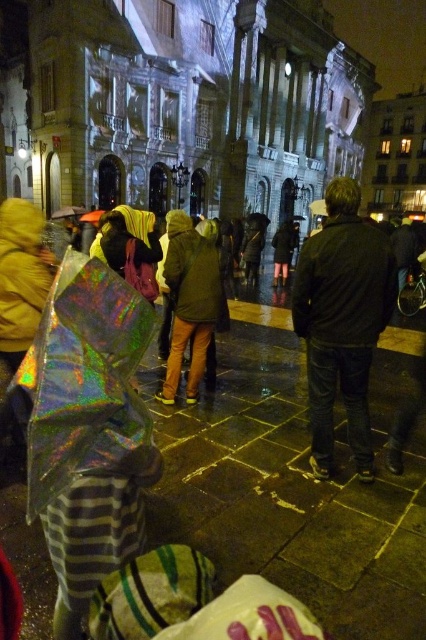
You are a photographer standing at the camera position. You want to capture a closeup of the holographic plastic bag at lower left. Is it possible to focus on it clearly without moving your position?

The holographic plastic bag at lower left is 22.53 meters away from the camera. Since it is relatively far away, focusing on it clearly from this distance without moving might be challenging and may require a telephoto lens for better clarity.

You are a photographer trying to capture the holographic plastic bag at lower left and the green matte jacket at center in the same frame. Which object should you adjust your camera to focus on first if you want to include both in the shot without moving the camera?

The holographic plastic bag at lower left is positioned on the right side of green matte jacket at center, so you should focus on the green matte jacket at center first since it is closer to the camera, allowing both objects to be in frame without moving the camera.